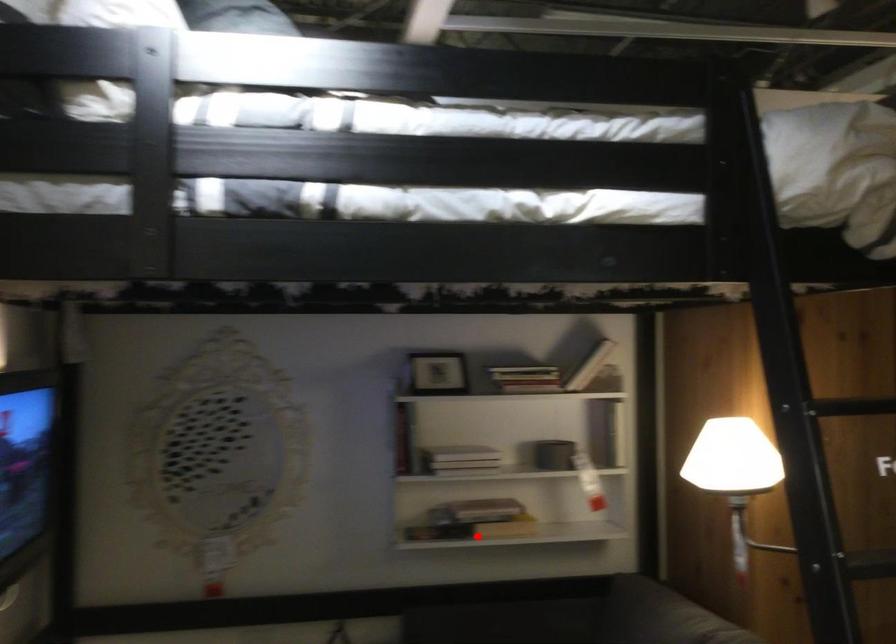
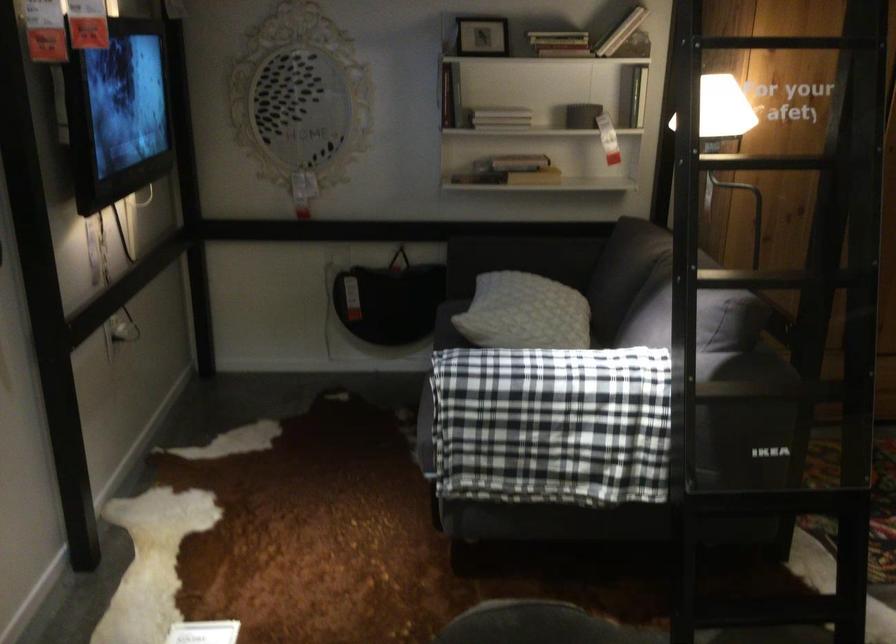
Where in the second image is the point corresponding to the highlighted location from the first image?

(509, 171)